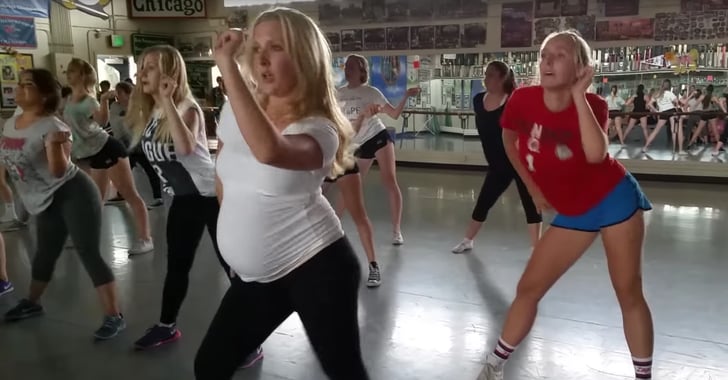
The height and width of the screenshot is (380, 728). Find the location of `pictures`. pictures is located at coordinates point(356,26), point(430,22), point(611,19), point(656,15).